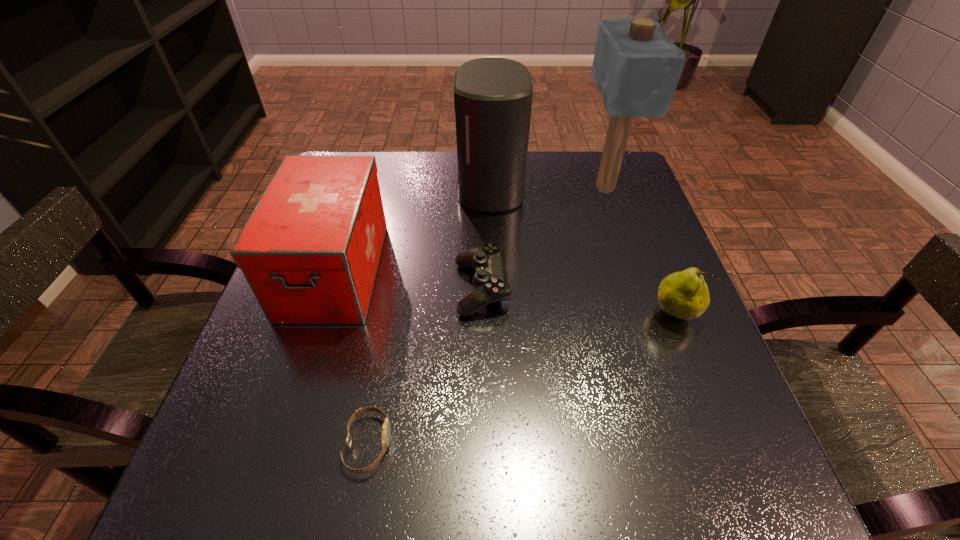
I want to click on mallet that is positioned at the right edge, so click(x=636, y=67).

This screenshot has width=960, height=540. What are the coordinates of `pear present at the right edge` in the screenshot? It's located at (684, 295).

Find the location of a particular element. This screenshot has width=960, height=540. object that is at the far right corner is located at coordinates (636, 67).

In the image, there is a desktop. Identify the location of vacant space at the far edge. The width and height of the screenshot is (960, 540). (445, 156).

Locate an element on the screen. vacant space at the near edge of the desktop is located at coordinates (455, 508).

In the image, there is a desktop. In order to click on vacant space at the left edge in this screenshot , I will do `click(259, 377)`.

Image resolution: width=960 pixels, height=540 pixels. What are the coordinates of `vacant space at the right edge of the desktop` in the screenshot? It's located at (621, 232).

Find the location of a particular element. This screenshot has width=960, height=540. vacant region at the far left corner is located at coordinates (387, 171).

Identify the location of free space between the second tallest object and the mallet. (547, 187).

At what (x,y) coordinates should I click in order to perform the action: click on vacant space in between the coffee maker and the fifth tallest object. Please return your answer as a coordinate pair (x, y). This screenshot has height=540, width=960. Looking at the image, I should click on (486, 238).